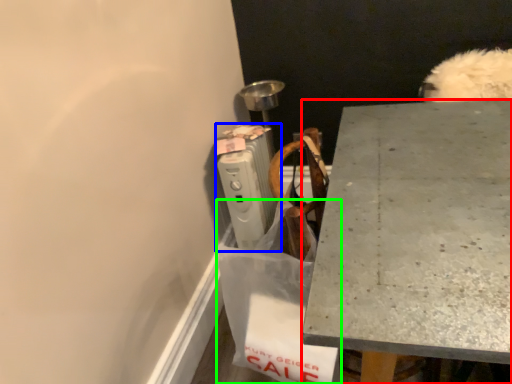
Question: Which object is positioned closest to desk (highlighted by a red box)? Select from radiator (highlighted by a blue box) and shopping bag (highlighted by a green box).

Choices:
 (A) radiator
 (B) shopping bag

Answer: (B)